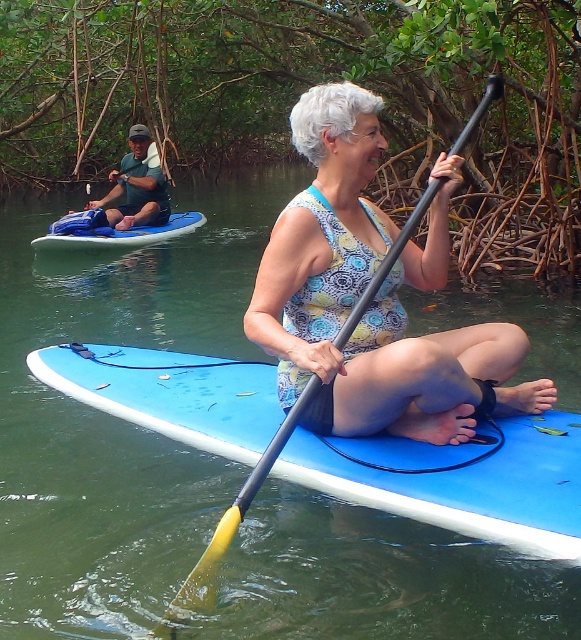
Is matte floral tank top at center wider than yellow rubber paddle at center?

Correct, the width of matte floral tank top at center exceeds that of yellow rubber paddle at center.

Based on the photo, between matte floral tank top at center and yellow rubber paddle at center, which one has less height?

Standing shorter between the two is yellow rubber paddle at center.

Between point (433, 388) and point (238, 504), which one is positioned in front?

Point (238, 504) is more forward.

Where is `matte floral tank top at center`? Image resolution: width=581 pixels, height=640 pixels. matte floral tank top at center is located at coordinates (375, 298).

In the scene shown: Is matte floral tank top at center wider than blue foam paddleboard at left?

No, matte floral tank top at center is not wider than blue foam paddleboard at left.

This screenshot has width=581, height=640. I want to click on matte floral tank top at center, so click(375, 298).

Between yellow rubber paddle at center and blue foam paddleboard at left, which one has less height?

Standing shorter between the two is yellow rubber paddle at center.

Between yellow rubber paddle at center and blue foam paddleboard at left, which one appears on the left side from the viewer's perspective?

Positioned to the left is blue foam paddleboard at left.

Image resolution: width=581 pixels, height=640 pixels. Describe the element at coordinates (243, 499) in the screenshot. I see `yellow rubber paddle at center` at that location.

Locate an element on the screen. Image resolution: width=581 pixels, height=640 pixels. yellow rubber paddle at center is located at coordinates (243, 499).